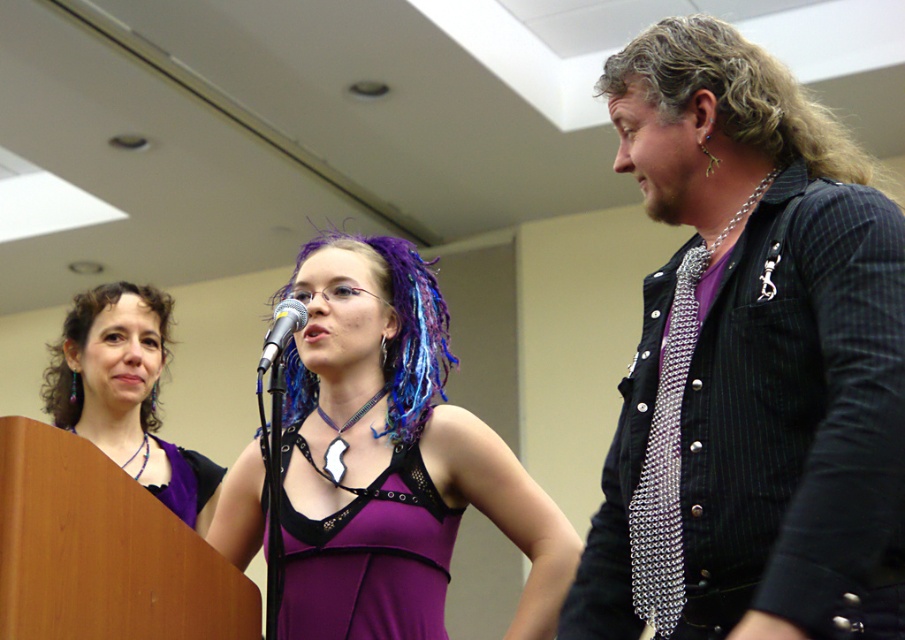
Does metallic chainmail vest at right have a smaller size compared to purple fabric dress at left?

Actually, metallic chainmail vest at right might be larger than purple fabric dress at left.

Does point (817, 108) come in front of point (138, 296)?

That is True.

Identify the location of metallic chainmail vest at right. The width and height of the screenshot is (905, 640). (750, 364).

Is purple matte dress at center positioned behind metallic silver microphone at center?

Yes, it is behind metallic silver microphone at center.

The image size is (905, 640). I want to click on purple matte dress at center, so click(x=394, y=454).

Find the location of a particular element. Image resolution: width=905 pixels, height=640 pixels. purple matte dress at center is located at coordinates (394, 454).

Which of these two, curly blonde hair at upper right or purple satin dress at left, stands taller?

With more height is curly blonde hair at upper right.

Can you confirm if curly blonde hair at upper right is positioned above purple satin dress at left?

Indeed, curly blonde hair at upper right is positioned over purple satin dress at left.

Between point (783, 140) and point (188, 490), which one is positioned in front?

Point (783, 140) is more forward.

I want to click on curly blonde hair at upper right, so click(x=736, y=93).